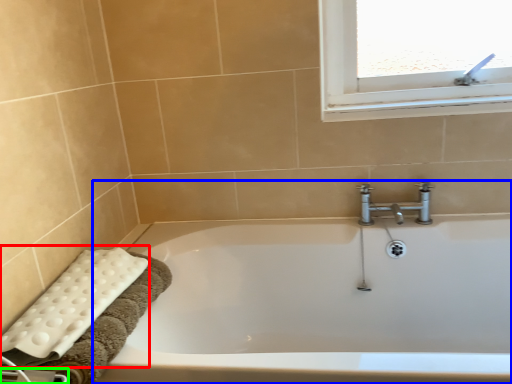
Question: Estimate the real-world distances between objects in this image. Which object is closer to bath towel (highlighted by a red box), bathtub (highlighted by a blue box) or towel bar (highlighted by a green box)?

Choices:
 (A) bathtub
 (B) towel bar

Answer: (B)